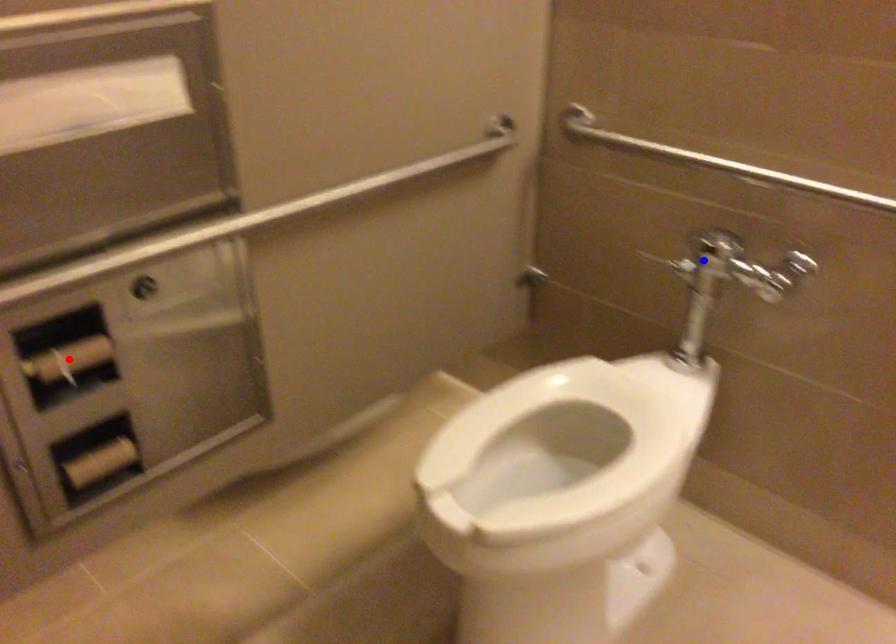
Question: Which of the two points in the image is closer to the camera?

Choices:
 (A) Blue point is closer.
 (B) Red point is closer.

Answer: (B)